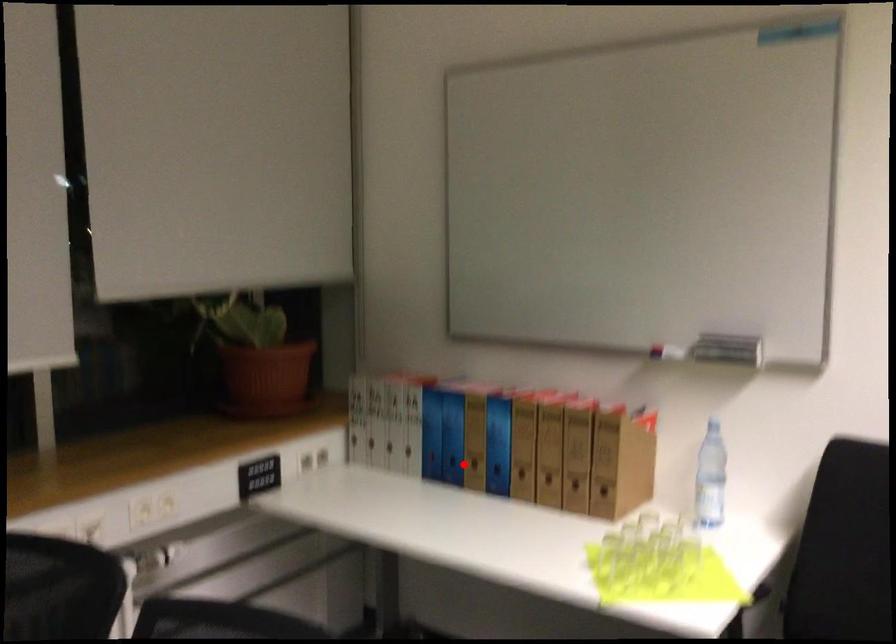
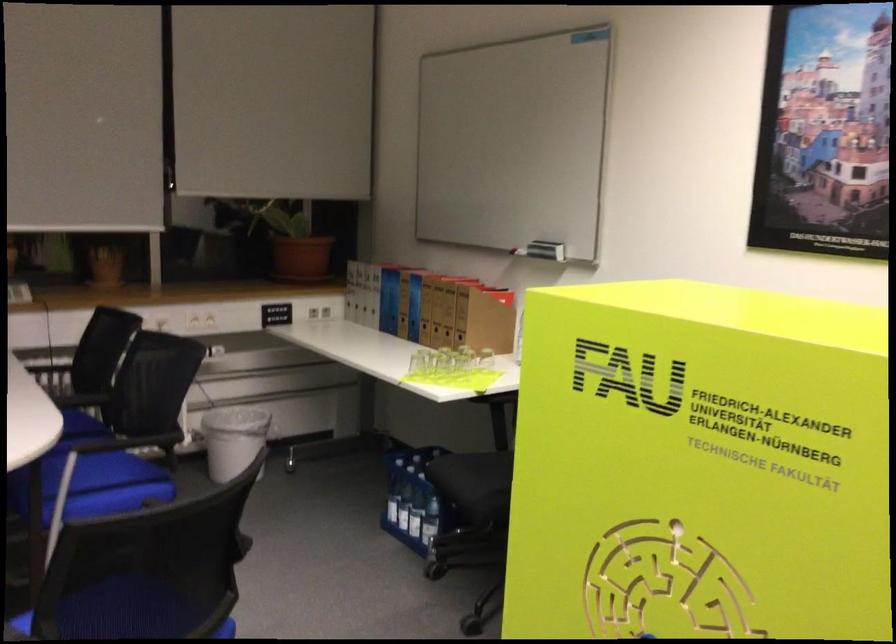
Question: I am providing you with two images of the same scene from different viewpoints. Image1 has a red point marked. In image2, the corresponding 3D location appears at what relative position? Reply with the corresponding letter.

Choices:
 (A) Closer
 (B) Farther

Answer: (B)